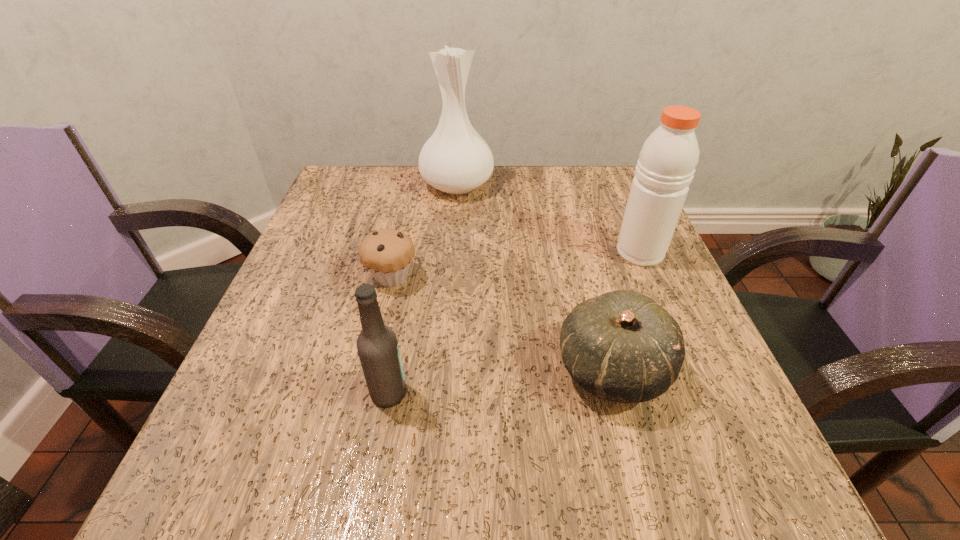
Select which object appears as the closest to the third tallest object. Please provide its 2D coordinates. Your answer should be formatted as a tuple, i.e. [(x, y)], where the tuple contains the x and y coordinates of a point satisfying the conditions above.

[(387, 253)]

Where is `vacant region that satisfies the following two spatial constraints: 1. on the front side of the fourth tallest object; 2. on the label of the third tallest object`? This screenshot has width=960, height=540. vacant region that satisfies the following two spatial constraints: 1. on the front side of the fourth tallest object; 2. on the label of the third tallest object is located at coordinates (618, 393).

This screenshot has height=540, width=960. In order to click on vacant space that satisfies the following two spatial constraints: 1. on the front side of the vase; 2. on the label of the third shortest object in this screenshot , I will do `click(442, 393)`.

You are a GUI agent. You are given a task and a screenshot of the screen. Output one action in this format:
    pyautogui.click(x=<x>, y=<y>)
    Task: Click on the blank area in the image that satisfies the following two spatial constraints: 1. on the front side of the muffin; 2. on the right side of the fourth tallest object
    
    Given the screenshot: What is the action you would take?
    pyautogui.click(x=372, y=369)